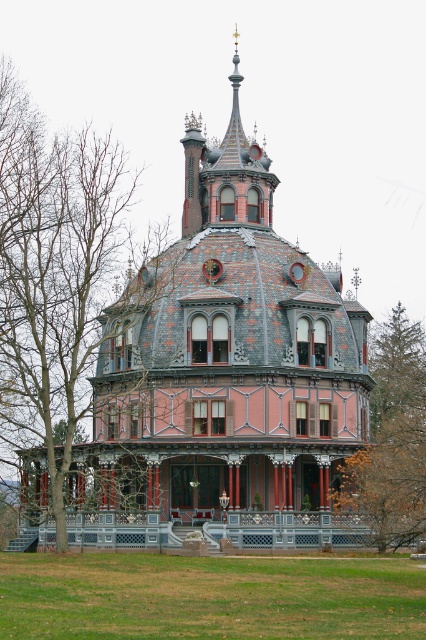
You are standing at the entrance of the grand Victorian house and want to know the exact location of the brown leafless tree at left. Can you determine its coordinates?

The brown leafless tree at left is located at coordinates point (x=52, y=278).

You are standing in front of the Victorian house and notice two trees. The first is a brown leafless tree at left, and the second is a brown wood tree at right. Based on their positions, which tree appears closer to the house?

The brown wood tree at right appears closer to the house because it is positioned below the brown leafless tree at left, suggesting it is in the foreground.

You are standing in front of the Victorian house and notice two trees. One is the brown leafless tree at left and the other is the brown wood tree at right. Which tree is taller?

The brown leafless tree at left is much taller than the brown wood tree at right.